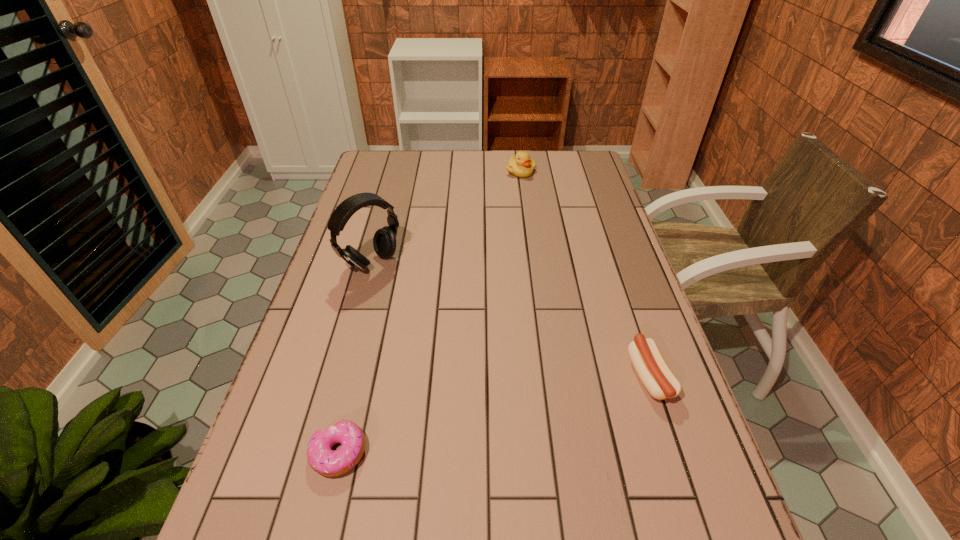
Identify the location of doughnut. The height and width of the screenshot is (540, 960). (322, 459).

You are a GUI agent. You are given a task and a screenshot of the screen. Output one action in this format:
    pyautogui.click(x=<x>, y=<y>)
    Task: Click on the nearest object
    The height and width of the screenshot is (540, 960).
    Given the screenshot: What is the action you would take?
    pyautogui.click(x=322, y=459)

Find the location of a particular element. The height and width of the screenshot is (540, 960). the third farthest object is located at coordinates (650, 366).

Image resolution: width=960 pixels, height=540 pixels. I want to click on sausage, so click(650, 366).

Find the location of `the tallest object`. the tallest object is located at coordinates (384, 241).

Locate an element on the screen. The width and height of the screenshot is (960, 540). earphone is located at coordinates (384, 241).

Find the location of a particular element. duckling is located at coordinates point(520,165).

At what (x,y) coordinates should I click in order to perform the action: click on the third shortest object. Please return your answer as a coordinate pair (x, y). The height and width of the screenshot is (540, 960). Looking at the image, I should click on (520, 165).

Locate an element on the screen. This screenshot has width=960, height=540. vacant space located 0.170m on the back of the nearest object is located at coordinates (361, 360).

This screenshot has width=960, height=540. Identify the location of free region located 0.260m on the back of the rightmost object. (615, 274).